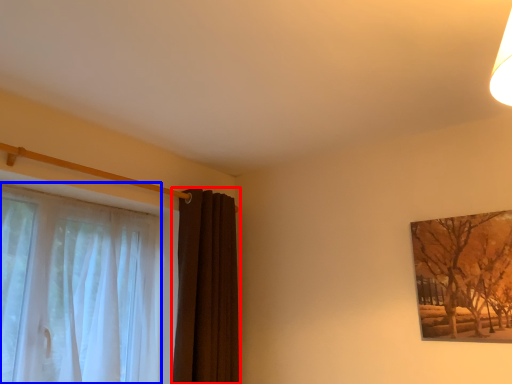
Question: Which of the following is the farthest to the observer, curtain (highlighted by a red box) or curtain (highlighted by a blue box)?

Choices:
 (A) curtain
 (B) curtain

Answer: (A)